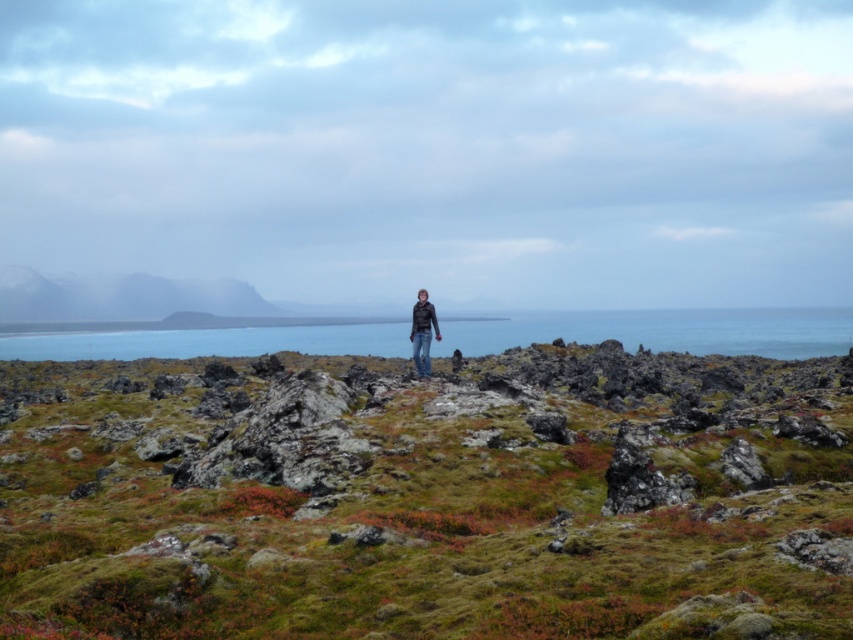
You are a hiker trying to determine the best path to reach the ocean in the background. You see the green mossy hillside at center and the matte black jacket at center. Which object is higher and would require more effort to climb?

The green mossy hillside at center is taller than the matte black jacket at center, so it would require more effort to climb.

You are standing at the camera position observing the landscape. There are two points marked in the image, point (480, 480) and point (450, 348). Which point is nearer to you?

Point (480, 480) is closer to the camera than point (450, 348), so the point nearer to you is point (480, 480).